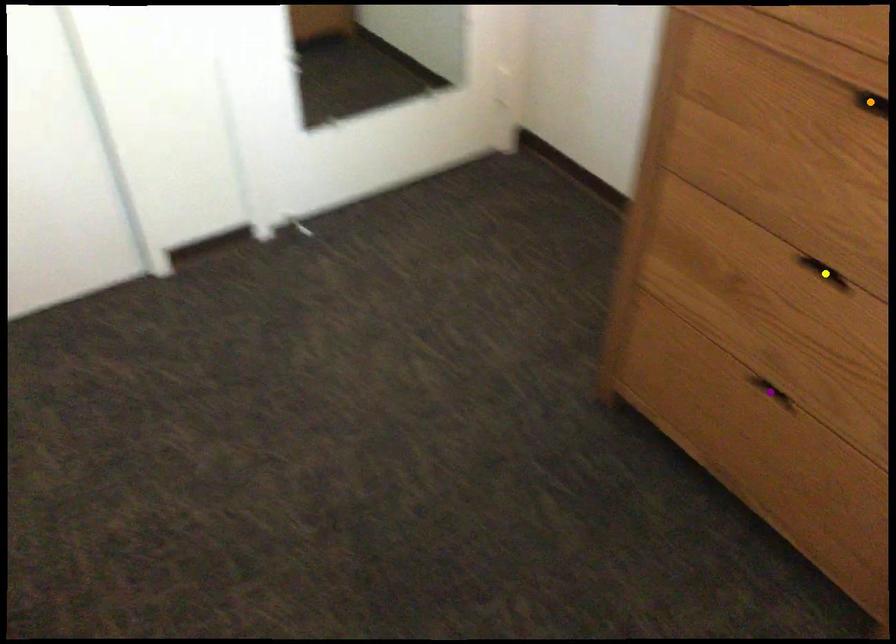
Order these from nearest to farthest:
1. yellow point
2. orange point
3. purple point

orange point → yellow point → purple point